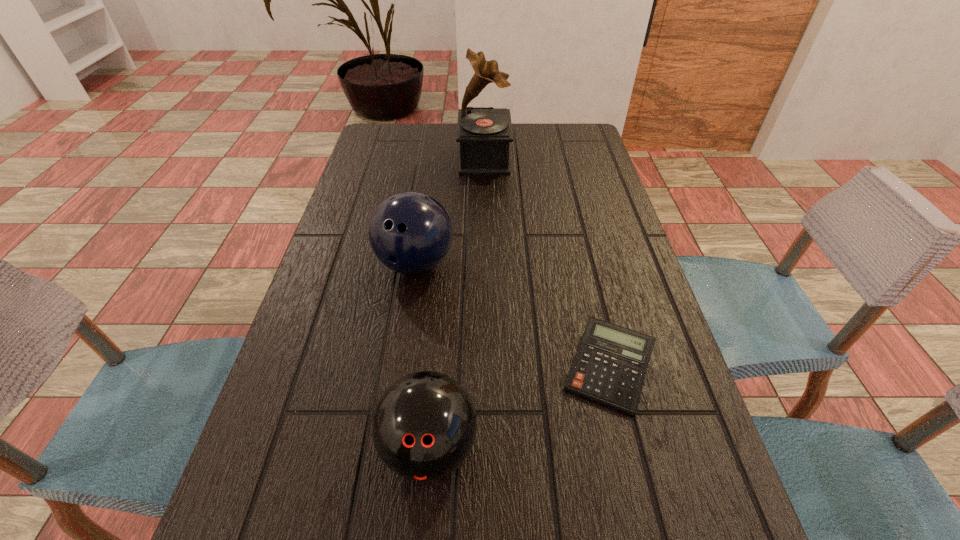
In order to click on the tallest object in this screenshot , I will do coord(484,133).

Identify the location of the farthest object. This screenshot has height=540, width=960. [x=484, y=133].

Image resolution: width=960 pixels, height=540 pixels. What are the coordinates of `the second farthest object` in the screenshot? It's located at 410,232.

The height and width of the screenshot is (540, 960). Identify the location of the nearer bowling ball. [x=424, y=426].

Find the location of a particular element. This screenshot has height=540, width=960. the shorter bowling ball is located at coordinates (424, 426).

In order to click on the rightmost object in this screenshot , I will do `click(609, 368)`.

Where is `the shortest object`? The height and width of the screenshot is (540, 960). the shortest object is located at coordinates (609, 368).

At what (x,y) coordinates should I click in order to perform the action: click on vacant region located 0.110m at the horn opening of the phonograph_record. Please return your answer as a coordinate pair (x, y). This screenshot has height=540, width=960. Looking at the image, I should click on (422, 158).

Locate an element on the screen. The image size is (960, 540). vacant area situated 0.260m at the horn opening of the phonograph_record is located at coordinates (373, 158).

Locate an element on the screen. The image size is (960, 540). free space located 0.240m at the horn opening of the phonograph_record is located at coordinates (380, 158).